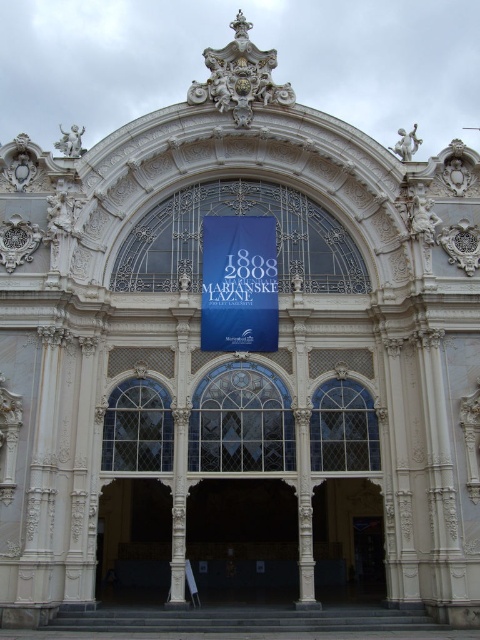
Question: Is blue fabric banner at center positioned in front of white stone archway at center?

Choices:
 (A) no
 (B) yes

Answer: (A)

Question: Which point is closer to the camera?

Choices:
 (A) blue fabric banner at center
 (B) white stone archway at center

Answer: (B)

Question: Which of the following is the farthest from the observer?

Choices:
 (A) blue fabric banner at center
 (B) white stone archway at center

Answer: (A)

Question: Does blue fabric banner at center have a lesser width compared to white stone archway at center?

Choices:
 (A) yes
 (B) no

Answer: (A)

Question: Can you confirm if blue fabric banner at center is bigger than white stone archway at center?

Choices:
 (A) yes
 (B) no

Answer: (B)